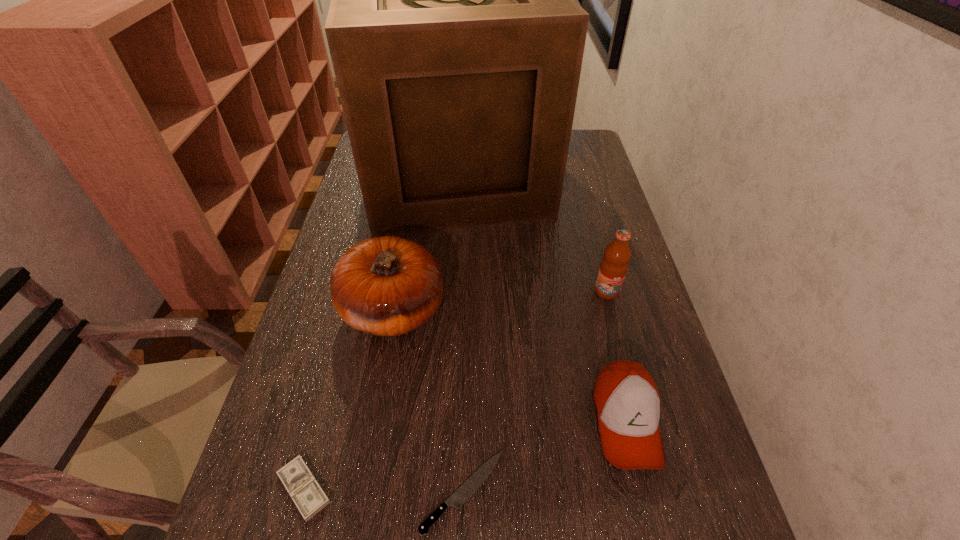
You are a GUI agent. You are given a task and a screenshot of the screen. Output one action in this format:
    pyautogui.click(x=<x>, y=<y>)
    Task: Click on the free space between the fruit juice and the pumpkin
    The height and width of the screenshot is (540, 960).
    Given the screenshot: What is the action you would take?
    pyautogui.click(x=499, y=300)

The height and width of the screenshot is (540, 960). What are the coordinates of `free area in between the box and the pumpkin` in the screenshot? It's located at [424, 242].

The height and width of the screenshot is (540, 960). Find the location of `unoccupied area between the steak knife and the fruit juice`. unoccupied area between the steak knife and the fruit juice is located at coordinates (535, 392).

In order to click on vacant region between the fruit juice and the shortest object in this screenshot , I will do `click(535, 392)`.

I want to click on vacant space that's between the pumpkin and the second shortest object, so 348,399.

Identify the location of vacant point located between the pumpkin and the steak knife. The height and width of the screenshot is (540, 960). (427, 401).

Where is `vacant space in between the money and the fruit juice`? Image resolution: width=960 pixels, height=540 pixels. vacant space in between the money and the fruit juice is located at coordinates (455, 390).

This screenshot has height=540, width=960. I want to click on unoccupied position between the fifth tallest object and the third shortest object, so click(x=465, y=455).

Locate an element on the screen. The width and height of the screenshot is (960, 540). free space that is in between the fruit juice and the shortest object is located at coordinates (535, 392).

Locate an element on the screen. The height and width of the screenshot is (540, 960). free space that is in between the fruit juice and the money is located at coordinates (455, 390).